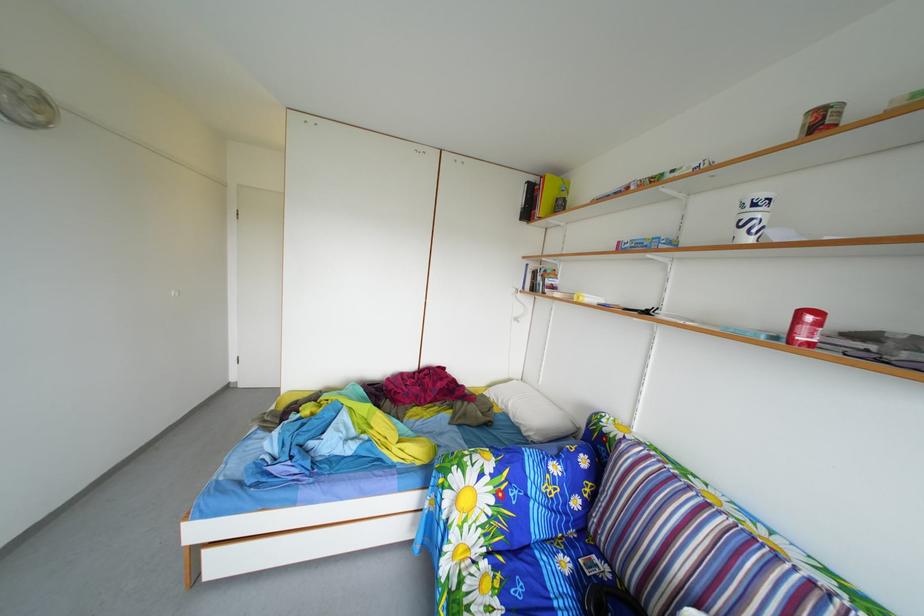
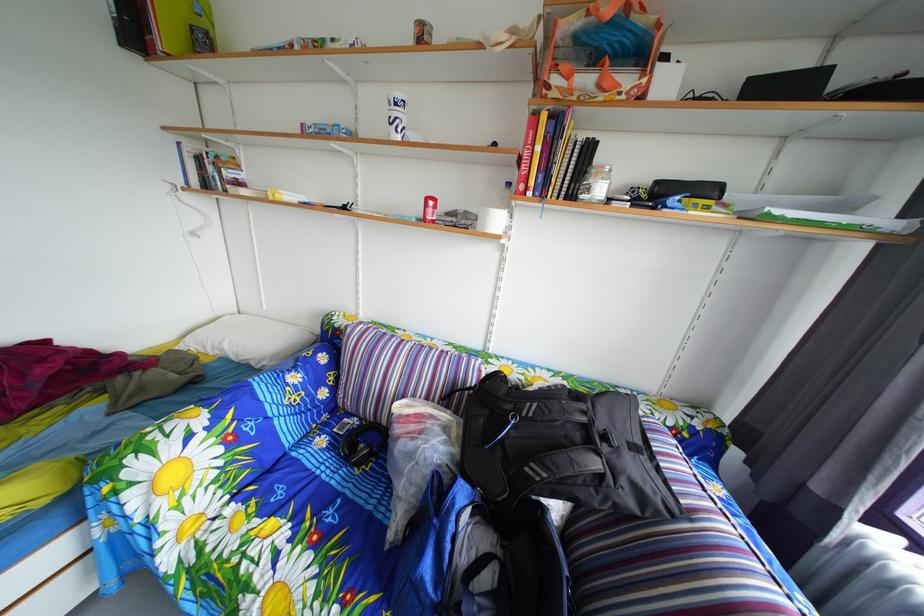
In the second image, find the point that corresponds to [759,217] in the first image.

(404, 116)